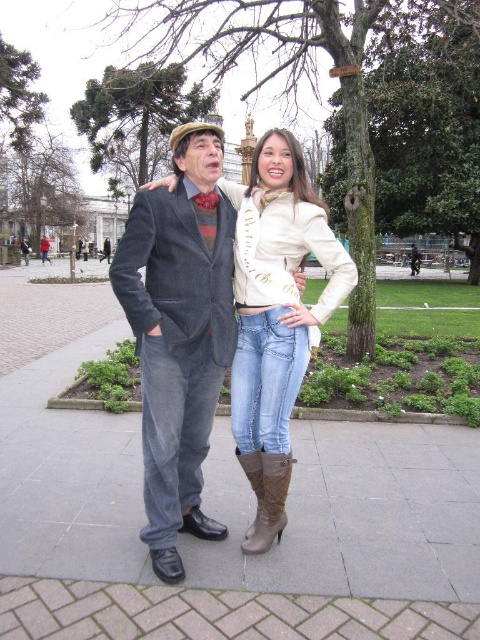
Question: Which of the following is the farthest from the observer?

Choices:
 (A) (285, 144)
 (B) (248, 460)

Answer: (A)

Question: Which point is closer to the camera taking this photo?

Choices:
 (A) (252, 168)
 (B) (276, 230)
 (C) (267, 509)

Answer: (C)

Question: Is denim jeans at center above light beige leather jacket at center?

Choices:
 (A) yes
 (B) no

Answer: (A)

Question: Is denim jeans at center thinner than light beige leather jacket at center?

Choices:
 (A) no
 (B) yes

Answer: (A)

Question: Does light beige leather jacket at center have a greater width compared to brown suede boot at lower center?

Choices:
 (A) yes
 (B) no

Answer: (A)

Question: Which point is closer to the camera?

Choices:
 (A) brown suede boot at lower center
 (B) light beige leather jacket at center

Answer: (A)